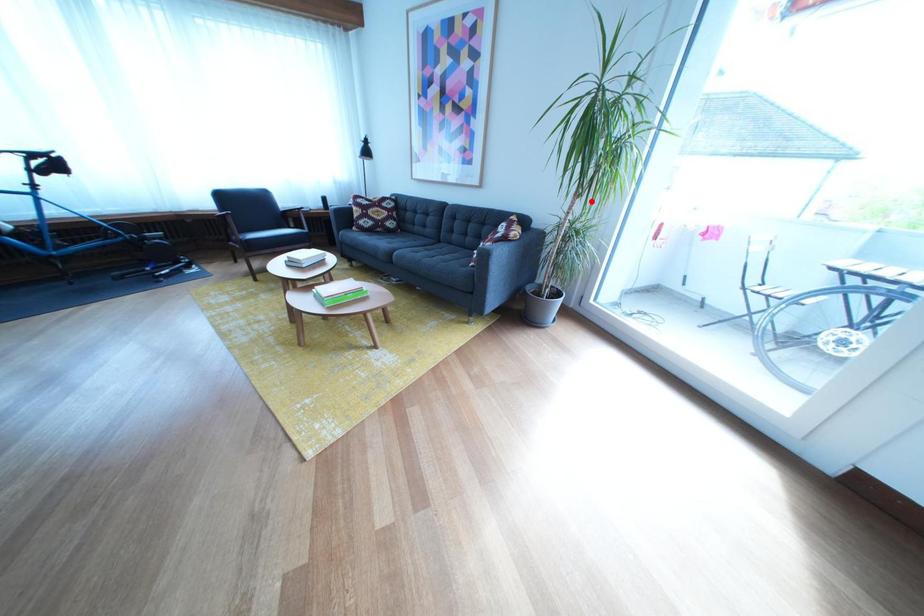
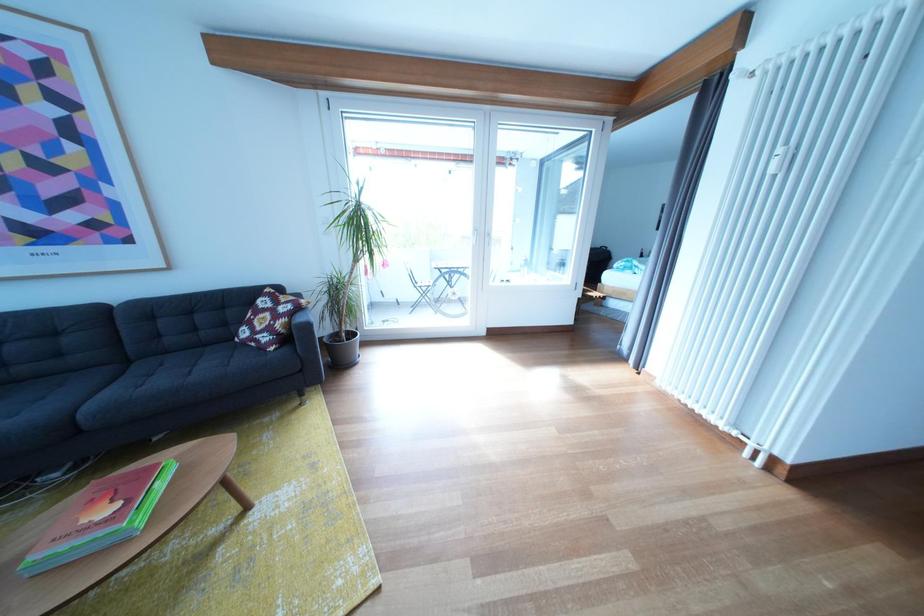
In the second image, find the point that corresponds to the highlighted location in the first image.

(370, 267)